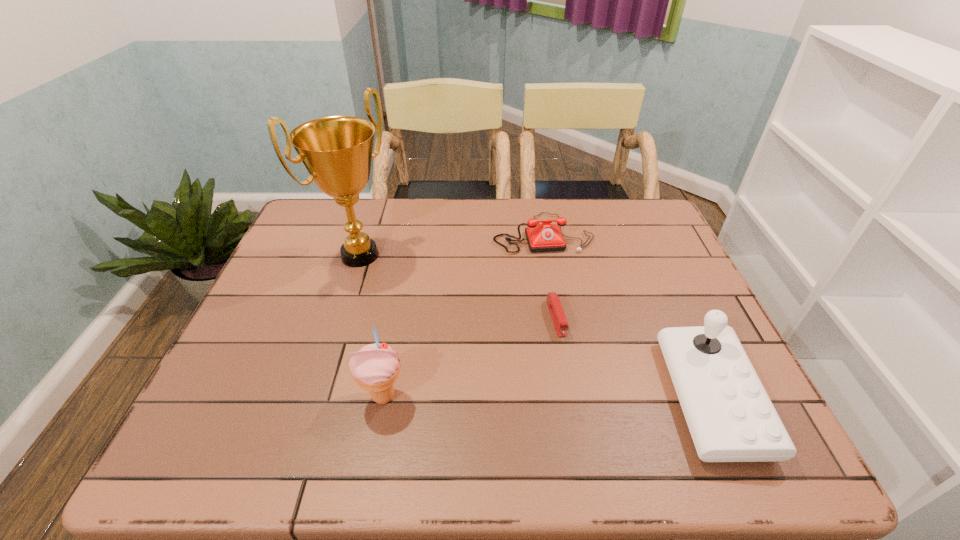
In the image, there is a desktop. Identify the location of vacant area at the far right corner. (657, 209).

I want to click on vacant point located between the joystick and the icecream, so click(547, 397).

This screenshot has width=960, height=540. Find the location of `unoccupied area between the telephone and the rightmost object`. unoccupied area between the telephone and the rightmost object is located at coordinates (627, 315).

Where is `vacant space in between the fourth tallest object and the shortest object`? The image size is (960, 540). vacant space in between the fourth tallest object and the shortest object is located at coordinates (549, 275).

Locate an element on the screen. empty space that is in between the telephone and the icecream is located at coordinates (463, 315).

Find the location of a particular element. vacant point located between the second shortest object and the third nearest object is located at coordinates (549, 275).

The image size is (960, 540). I want to click on vacant space that's between the award and the icecream, so click(x=372, y=326).

Identify the location of free space between the icecream and the tallest object. Image resolution: width=960 pixels, height=540 pixels. [372, 326].

This screenshot has height=540, width=960. I want to click on blank region between the telephone and the icecream, so click(x=463, y=315).

Locate an element on the screen. The height and width of the screenshot is (540, 960). empty location between the shortest object and the telephone is located at coordinates (x=549, y=275).